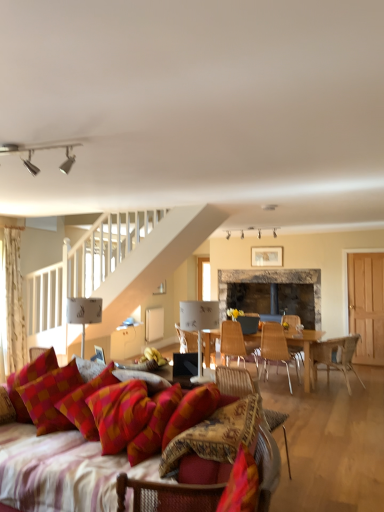
Question: Does silver metallic track lights at upper center, placed as the 3th lamp when sorted from back to front, have a lesser width compared to wooden chair at right, which appears as the 4th chair when viewed from the back?

Choices:
 (A) yes
 (B) no

Answer: (A)

Question: Is silver metallic track lights at upper center, the third lamp from the bottom, next to wooden chair at right, which appears as the 3th chair when viewed from the front, and touching it?

Choices:
 (A) yes
 (B) no

Answer: (B)

Question: From a real-world perspective, is silver metallic track lights at upper center, acting as the first lamp starting from the top, located beneath wooden chair at right, which appears as the 3th chair when viewed from the front?

Choices:
 (A) yes
 (B) no

Answer: (B)

Question: Considering the relative sizes of silver metallic track lights at upper center, the 2th lamp viewed from the right, and wooden chair at right, which appears as the 3th chair when viewed from the front, in the image provided, is silver metallic track lights at upper center, the 2th lamp viewed from the right, taller than wooden chair at right, which appears as the 3th chair when viewed from the front,?

Choices:
 (A) no
 (B) yes

Answer: (A)

Question: Is wooden chair at right, which appears as the 3th chair when viewed from the front, located within silver metallic track lights at upper center, the second lamp viewed from the left?

Choices:
 (A) no
 (B) yes

Answer: (A)

Question: From the image's perspective, is red checkered pillow at lower left above or below rustic stone fireplace at center?

Choices:
 (A) below
 (B) above

Answer: (B)

Question: From their relative heights in the image, would you say red checkered pillow at lower left is taller or shorter than rustic stone fireplace at center?

Choices:
 (A) short
 (B) tall

Answer: (A)

Question: Considering the relative positions of red checkered pillow at lower left and rustic stone fireplace at center in the image provided, is red checkered pillow at lower left to the left or to the right of rustic stone fireplace at center?

Choices:
 (A) left
 (B) right

Answer: (A)

Question: Would you say red checkered pillow at lower left is inside or outside rustic stone fireplace at center?

Choices:
 (A) inside
 (B) outside

Answer: (B)

Question: Considering their positions, is patterned fabric chair at center, acting as the 5th chair starting from the back, located in front of or behind plush fabric couch at lower left?

Choices:
 (A) behind
 (B) front

Answer: (A)

Question: From a real-world perspective, relative to plush fabric couch at lower left, is patterned fabric chair at center, acting as the 5th chair starting from the back, vertically above or below?

Choices:
 (A) below
 (B) above

Answer: (B)

Question: Would you say patterned fabric chair at center, acting as the second chair starting from the front, is to the left or to the right of plush fabric couch at lower left in the picture?

Choices:
 (A) left
 (B) right

Answer: (B)

Question: Is point (274, 426) closer or farther from the camera than point (86, 370)?

Choices:
 (A) farther
 (B) closer

Answer: (A)

Question: Is wooden chair at center, the fifth chair from the front, bigger or smaller than wooden chair at center, positioned as the 4th chair in front-to-back order?

Choices:
 (A) small
 (B) big

Answer: (A)

Question: Looking at their shapes, would you say wooden chair at center, the fifth chair from the front, is wider or thinner than wooden chair at center, placed as the 3th chair when sorted from back to front?

Choices:
 (A) thin
 (B) wide

Answer: (A)